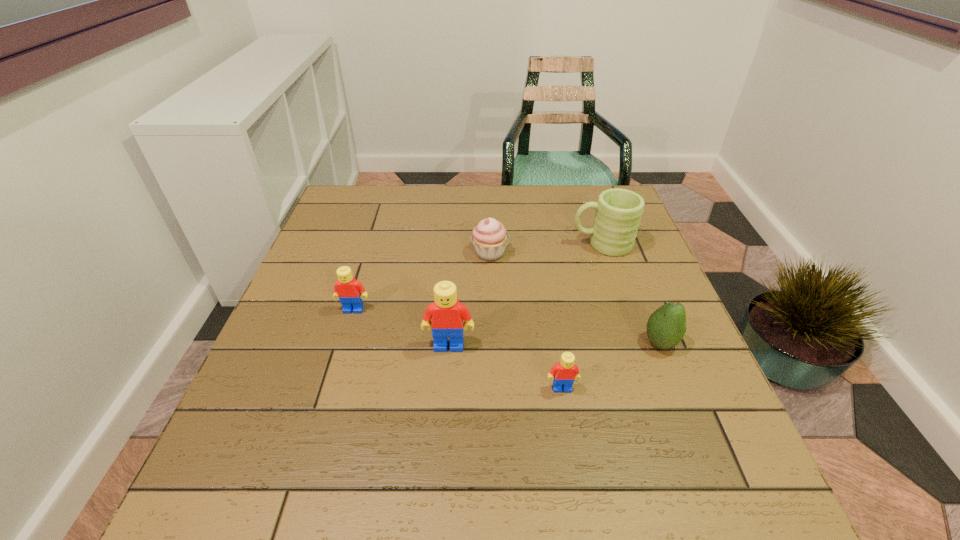
This screenshot has width=960, height=540. I want to click on free point that keeps the Legos evenly spaced on the right, so click(x=699, y=440).